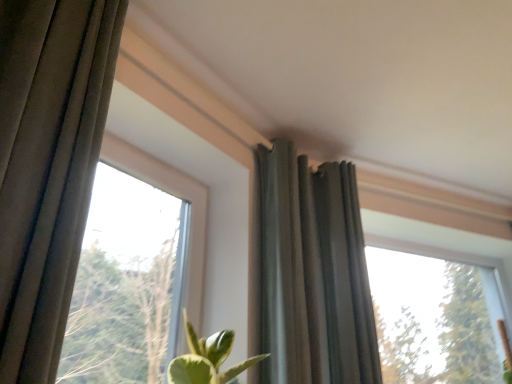
Question: Considering the relative positions of dark gray fabric curtain at upper center and transparent glass window at upper right, arranged as the 2th window when viewed from the front, in the image provided, is dark gray fabric curtain at upper center to the left of transparent glass window at upper right, arranged as the 2th window when viewed from the front, from the viewer's perspective?

Choices:
 (A) yes
 (B) no

Answer: (A)

Question: Is dark gray fabric curtain at upper center turned away from transparent glass window at upper right, the 2th window in the left-to-right sequence?

Choices:
 (A) no
 (B) yes

Answer: (A)

Question: Would you consider dark gray fabric curtain at upper center to be distant from transparent glass window at upper right, marked as the 1th window in a right-to-left arrangement?

Choices:
 (A) yes
 (B) no

Answer: (A)

Question: Can you confirm if dark gray fabric curtain at upper center is positioned to the right of transparent glass window at upper right, marked as the 1th window in a right-to-left arrangement?

Choices:
 (A) no
 (B) yes

Answer: (A)

Question: Is dark gray fabric curtain at upper center outside of transparent glass window at upper right, marked as the 1th window in a right-to-left arrangement?

Choices:
 (A) yes
 (B) no

Answer: (A)

Question: Does dark gray fabric curtain at upper center have a smaller size compared to transparent glass window at upper right, the 1th window positioned from the back?

Choices:
 (A) yes
 (B) no

Answer: (A)

Question: Considering the relative positions of transparent glass window at upper right, the 2th window in the left-to-right sequence, and transparent glass window at upper left, the first window viewed from the front, in the image provided, is transparent glass window at upper right, the 2th window in the left-to-right sequence, to the right of transparent glass window at upper left, the first window viewed from the front, from the viewer's perspective?

Choices:
 (A) yes
 (B) no

Answer: (A)

Question: Can you confirm if transparent glass window at upper right, marked as the 1th window in a right-to-left arrangement, is smaller than transparent glass window at upper left, the first window viewed from the front?

Choices:
 (A) yes
 (B) no

Answer: (B)

Question: From the image's perspective, is transparent glass window at upper right, the 1th window positioned from the back, located beneath transparent glass window at upper left, arranged as the second window when viewed from the right?

Choices:
 (A) no
 (B) yes

Answer: (B)

Question: Is transparent glass window at upper right, marked as the 1th window in a right-to-left arrangement, in front of transparent glass window at upper left, arranged as the second window when viewed from the right?

Choices:
 (A) yes
 (B) no

Answer: (B)

Question: From a real-world perspective, does transparent glass window at upper right, marked as the 1th window in a right-to-left arrangement, sit lower than transparent glass window at upper left, arranged as the second window when viewed from the right?

Choices:
 (A) yes
 (B) no

Answer: (B)

Question: Does transparent glass window at upper right, marked as the 1th window in a right-to-left arrangement, turn towards transparent glass window at upper left, which is the first window from left to right?

Choices:
 (A) yes
 (B) no

Answer: (B)

Question: Is transparent glass window at upper right, the 2th window in the left-to-right sequence, to the left of dark gray fabric curtain at upper center from the viewer's perspective?

Choices:
 (A) yes
 (B) no

Answer: (B)